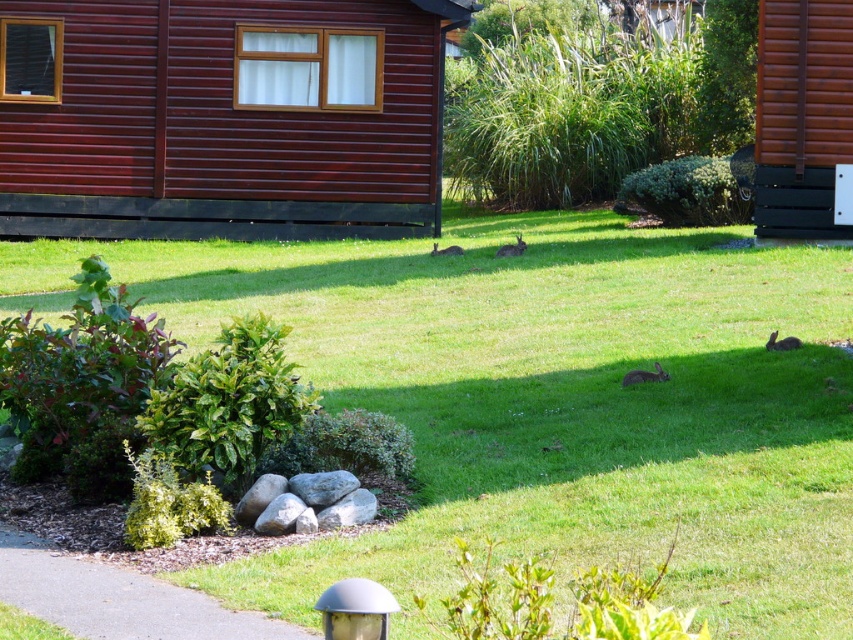
You are a gardener who wants to mow the lawn. You see the green grass at center and the wooden cabin at upper left. Which area should you focus on first to ensure the grass doesn

The green grass at center should be mowed first because it is much taller than the wooden cabin at upper left, indicating it needs attention.

You are planning to set up a picnic area in the green grass at center. Considering the size of the brown wooden cabin at right, will there be enough space for a picnic blanket and some chairs?

The green grass at center is bigger than the brown wooden cabin at right, so there should be sufficient space for a picnic blanket and chairs since the grassy area is larger than the cabin.